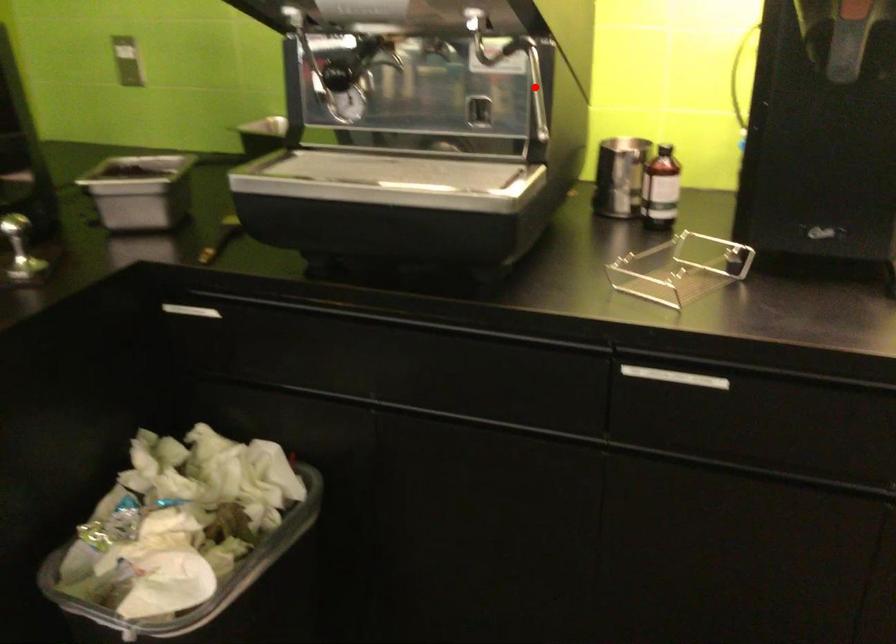
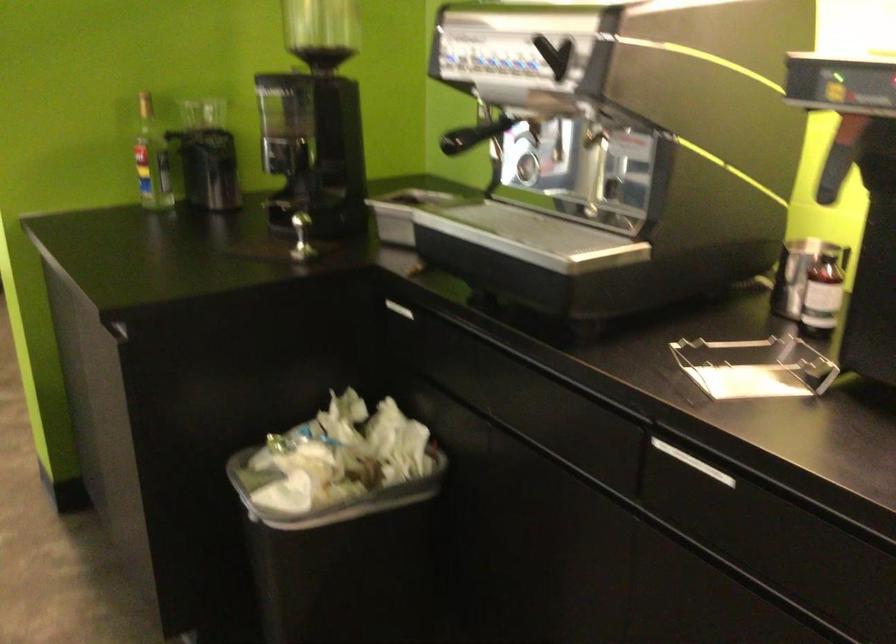
Find the pixel in the second image that matches the highlighted location in the first image.

(592, 171)